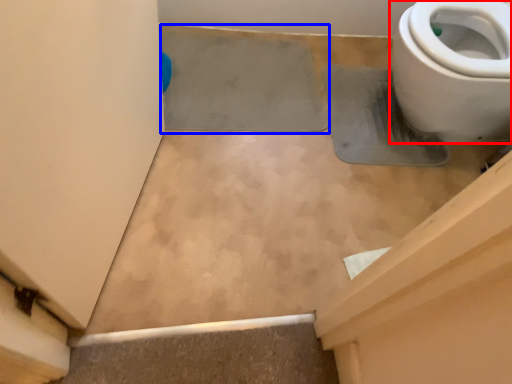
Question: Among these objects, which one is farthest to the camera, toilet (highlighted by a red box) or concrete (highlighted by a blue box)?

Choices:
 (A) toilet
 (B) concrete

Answer: (B)